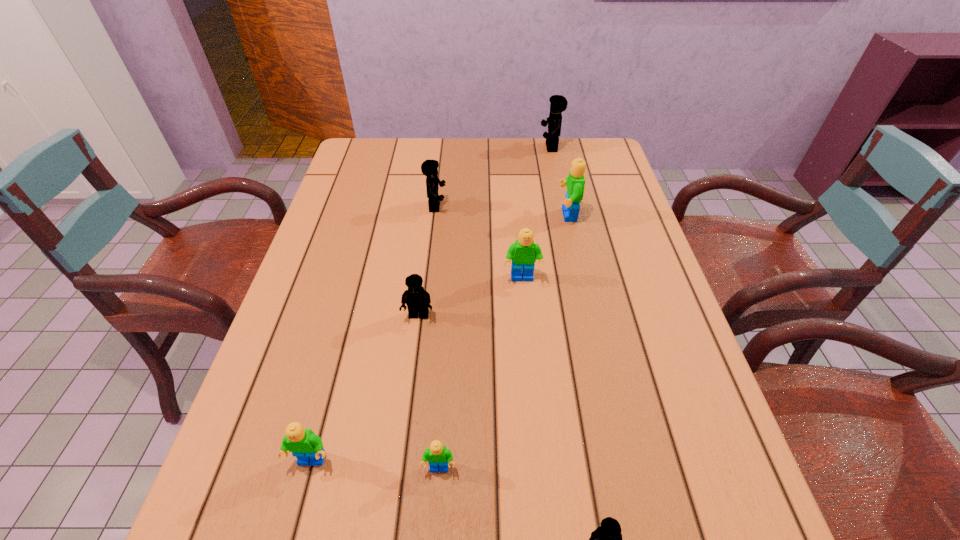
This screenshot has height=540, width=960. Identify the location of the biggest yellow Lego. (558, 103).

Where is `the farthest yellow Lego`? This screenshot has height=540, width=960. the farthest yellow Lego is located at coordinates 558,103.

Find the location of a particular element. the rightmost green Lego is located at coordinates (575, 182).

This screenshot has width=960, height=540. Find the location of `the biggest green Lego`. the biggest green Lego is located at coordinates (575, 182).

Locate an element on the screen. The image size is (960, 540). the third nearest yellow Lego is located at coordinates (429, 168).

This screenshot has width=960, height=540. In order to click on the third nearest green Lego in this screenshot , I will do `click(523, 253)`.

I want to click on the fifth nearest object, so click(x=523, y=253).

Where is `the second nearest yellow Lego`? The height and width of the screenshot is (540, 960). the second nearest yellow Lego is located at coordinates (417, 299).

Locate an element on the screen. Image resolution: width=960 pixels, height=540 pixels. the fifth farthest object is located at coordinates 417,299.

What are the coordinates of `the leftmost green Lego` in the screenshot? It's located at (305, 445).